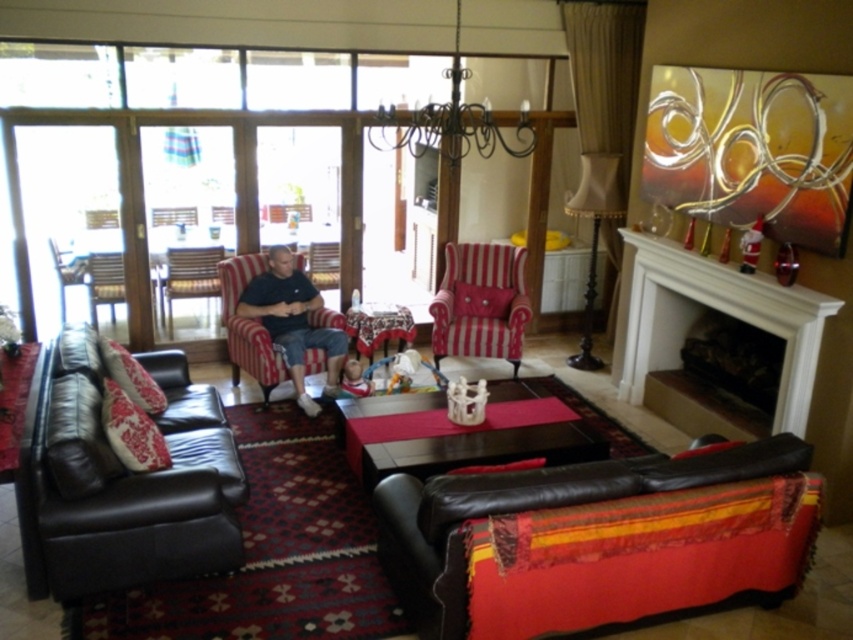
You are standing at the entrance of the living room and want to place a new plant pot at the point labeled as point (590, 541). Based on the scene description, where exactly should you place the plant pot?

The point (590, 541) is on the leather couch at lower right, so you should place the plant pot on the leather couch at lower right.

You are standing in the living room and want to determine which of the two points, point (703, 596) or point (822, 324), is closer to you. Based on the scene description, which point is nearer?

Point (703, 596) is closer to the camera than point (822, 324), so it is nearer to you.